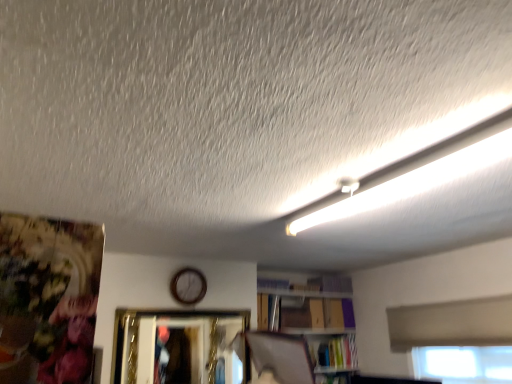
Question: Considering the relative positions of white fluorescent tube at upper right and wooden clock at center in the image provided, is white fluorescent tube at upper right to the right of wooden clock at center from the viewer's perspective?

Choices:
 (A) no
 (B) yes

Answer: (B)

Question: From a real-world perspective, is white fluorescent tube at upper right on top of wooden clock at center?

Choices:
 (A) yes
 (B) no

Answer: (A)

Question: Is white fluorescent tube at upper right touching wooden clock at center?

Choices:
 (A) no
 (B) yes

Answer: (A)

Question: From the image's perspective, is white fluorescent tube at upper right located above wooden clock at center?

Choices:
 (A) no
 (B) yes

Answer: (B)

Question: Can we say white fluorescent tube at upper right lies outside wooden clock at center?

Choices:
 (A) no
 (B) yes

Answer: (B)

Question: Can you confirm if white fluorescent tube at upper right is wider than wooden clock at center?

Choices:
 (A) no
 (B) yes

Answer: (B)

Question: Could you tell me if white fluorescent tube at upper right is facing hardcover book at lower right?

Choices:
 (A) yes
 (B) no

Answer: (B)

Question: Is white fluorescent tube at upper right positioned in front of hardcover book at lower right?

Choices:
 (A) no
 (B) yes

Answer: (B)

Question: Could hardcover book at lower right be considered to be inside white fluorescent tube at upper right?

Choices:
 (A) yes
 (B) no

Answer: (B)

Question: Is white fluorescent tube at upper right not near hardcover book at lower right?

Choices:
 (A) no
 (B) yes

Answer: (B)

Question: Is white fluorescent tube at upper right with hardcover book at lower right?

Choices:
 (A) yes
 (B) no

Answer: (B)

Question: Considering the relative sizes of white fluorescent tube at upper right and hardcover book at lower right in the image provided, is white fluorescent tube at upper right thinner than hardcover book at lower right?

Choices:
 (A) yes
 (B) no

Answer: (A)

Question: From the image's perspective, would you say gold metallic picture frame at center is shown under hardcover book at lower right?

Choices:
 (A) no
 (B) yes

Answer: (A)